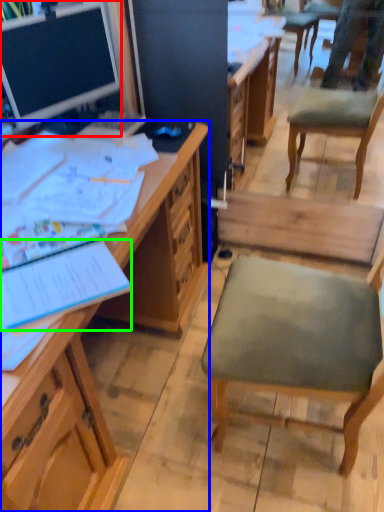
Question: Considering the real-world distances, which object is farthest from desk (highlighted by a red box)? desk (highlighted by a blue box) or notebook (highlighted by a green box)?

Choices:
 (A) desk
 (B) notebook

Answer: (B)